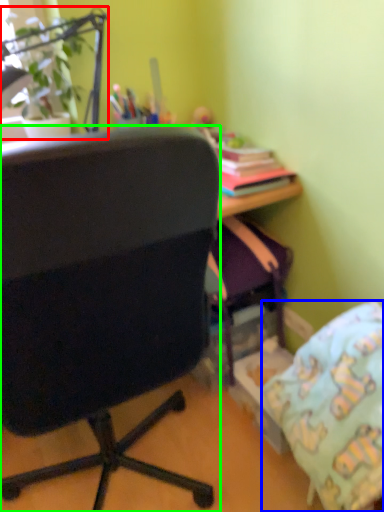
Question: Based on their relative distances, which object is farther from houseplant (highlighted by a red box)? Choose from pillow (highlighted by a blue box) and chair (highlighted by a green box).

Choices:
 (A) pillow
 (B) chair

Answer: (A)